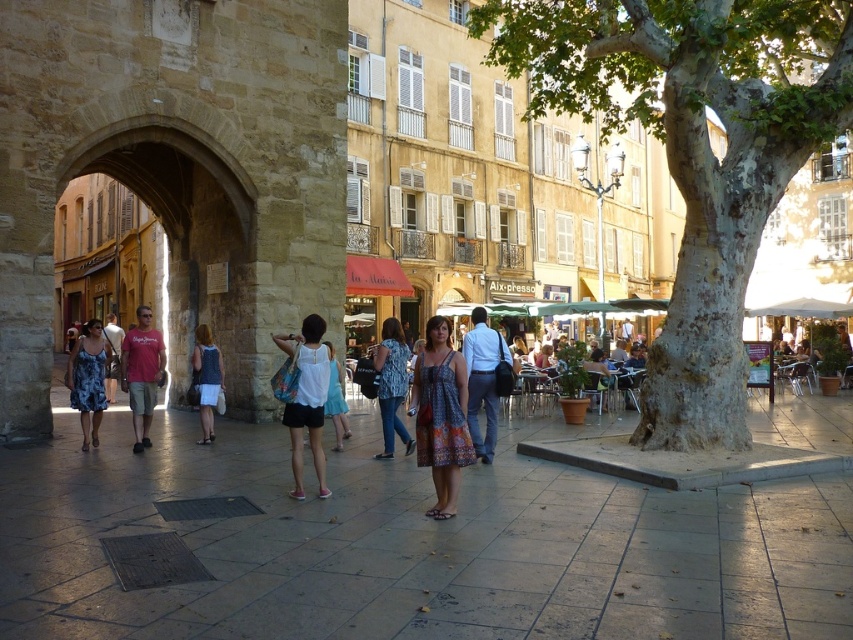
Question: Observing the image, what is the correct spatial positioning of dress at center in reference to blue floral dress at left?

Choices:
 (A) above
 (B) below

Answer: (B)

Question: Which point is closer to the camera?

Choices:
 (A) denim jeans at center
 (B) smooth stone pavement at center
 (C) matte red t-shirt at center

Answer: (B)

Question: Which point is closer to the camera?

Choices:
 (A) (71, 572)
 (B) (450, 346)
 (C) (83, 392)

Answer: (A)

Question: Is green rough bark tree at center above denim dress at center?

Choices:
 (A) yes
 (B) no

Answer: (A)

Question: Is green rough bark tree at center smaller than dress at center?

Choices:
 (A) yes
 (B) no

Answer: (B)

Question: Which of the following is the farthest from the observer?

Choices:
 (A) (138, 392)
 (B) (393, 323)
 (C) (90, 412)

Answer: (B)